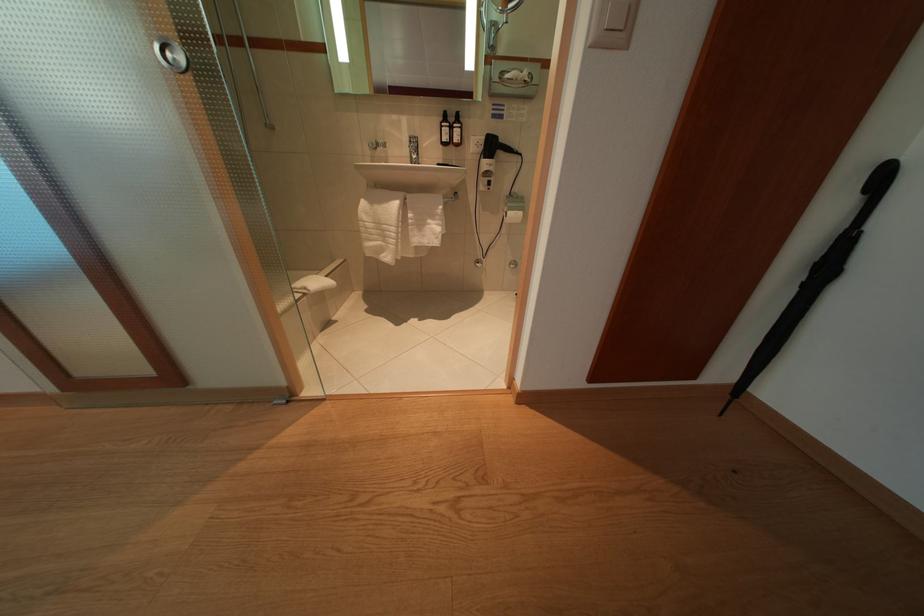
This screenshot has width=924, height=616. Describe the element at coordinates (171, 55) in the screenshot. I see `the round door handle` at that location.